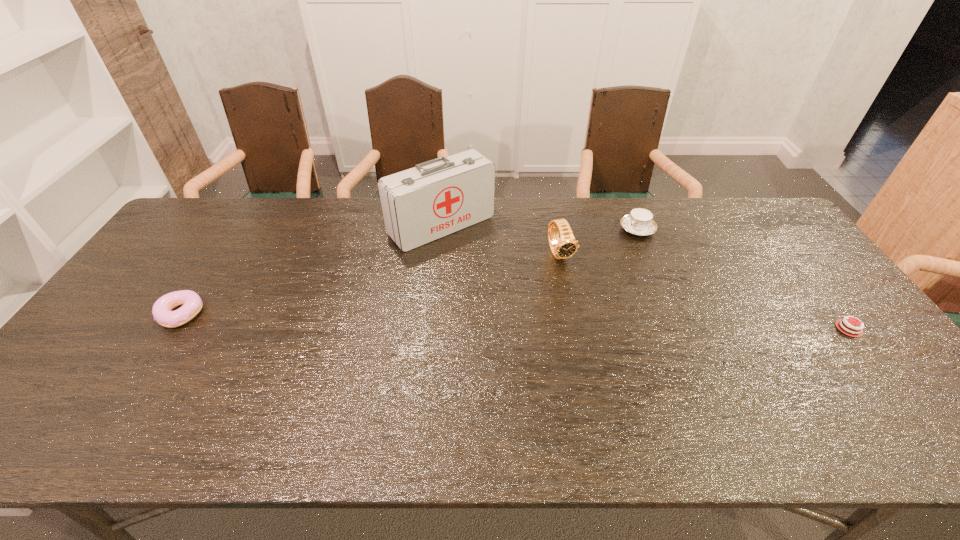
I want to click on free spot between the shortest object and the fourth object from left to right, so click(743, 279).

At what (x,y) coordinates should I click in order to perform the action: click on free space that is in between the tallest object and the leftmost object. Please return your answer as a coordinate pair (x, y). This screenshot has height=540, width=960. Looking at the image, I should click on (311, 269).

Where is `blank region between the first-aid kit and the shortest object`? blank region between the first-aid kit and the shortest object is located at coordinates (645, 277).

The image size is (960, 540). What are the coordinates of `vacant space that is in between the third object from left to right and the doughnut` in the screenshot? It's located at (372, 284).

Locate an element on the screen. vacant point located between the doughnut and the tallest object is located at coordinates (311, 269).

Identify the location of vacant area that lies between the chocolate cake and the teacup. This screenshot has height=540, width=960. [743, 279].

I want to click on free space between the third object from left to right and the rightmost object, so click(705, 291).

The width and height of the screenshot is (960, 540). I want to click on empty space that is in between the second shortest object and the third object from right to left, so click(372, 284).

Identify the location of free point between the second shortest object and the third object from right to left. Image resolution: width=960 pixels, height=540 pixels. click(372, 284).

Find the location of a particular element. the second closest object to the first-aid kit is located at coordinates (x=639, y=222).